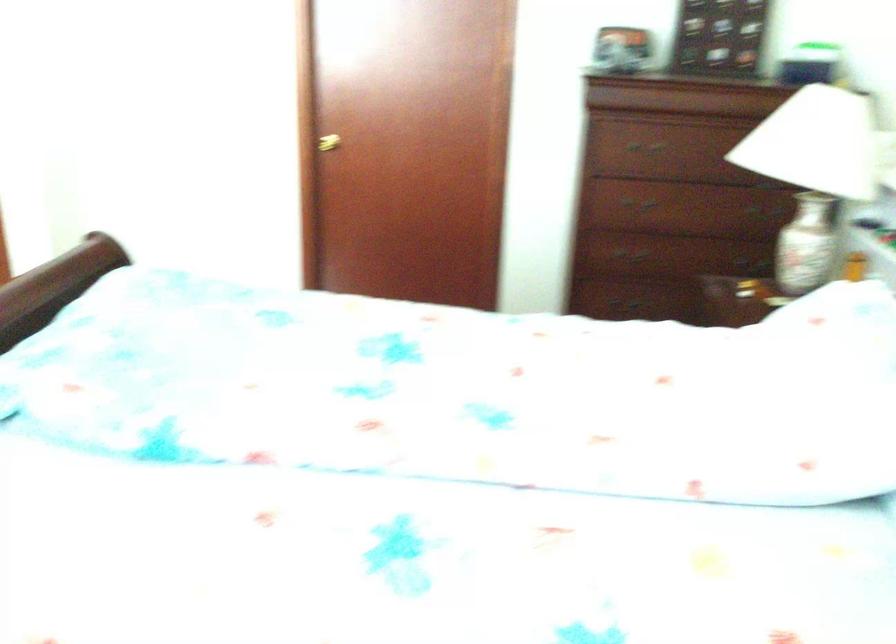
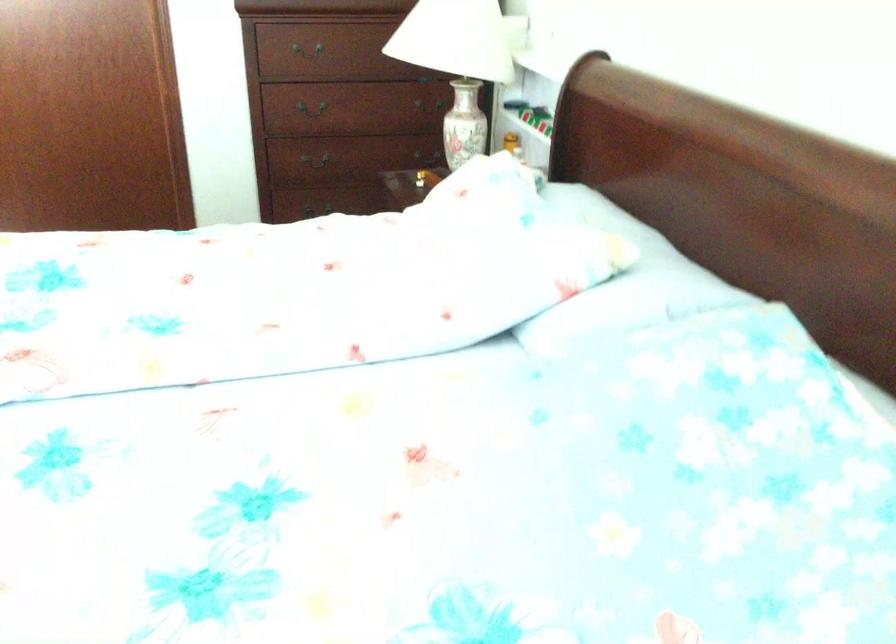
The point at (x=643, y=205) is marked in the first image. Where is the corresponding point in the second image?

(313, 108)